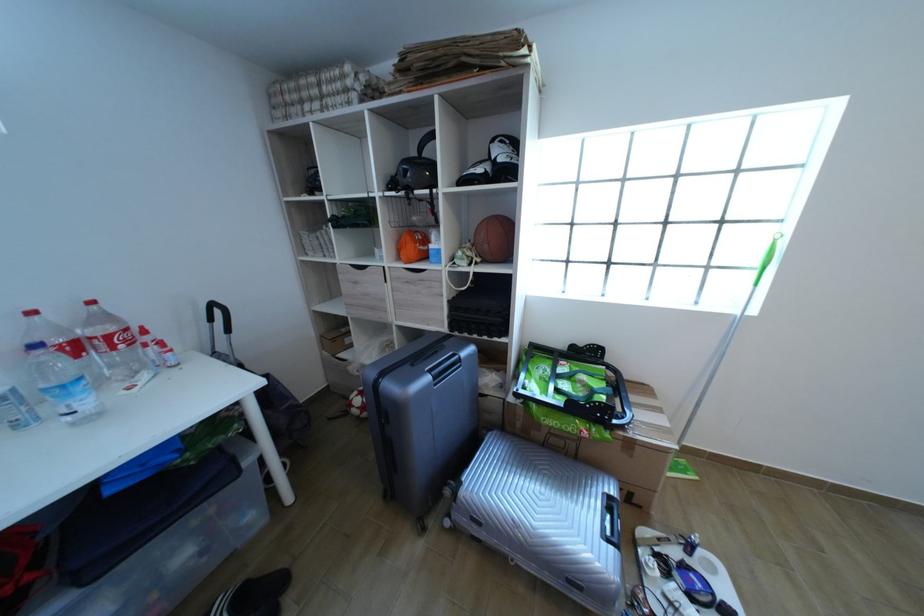
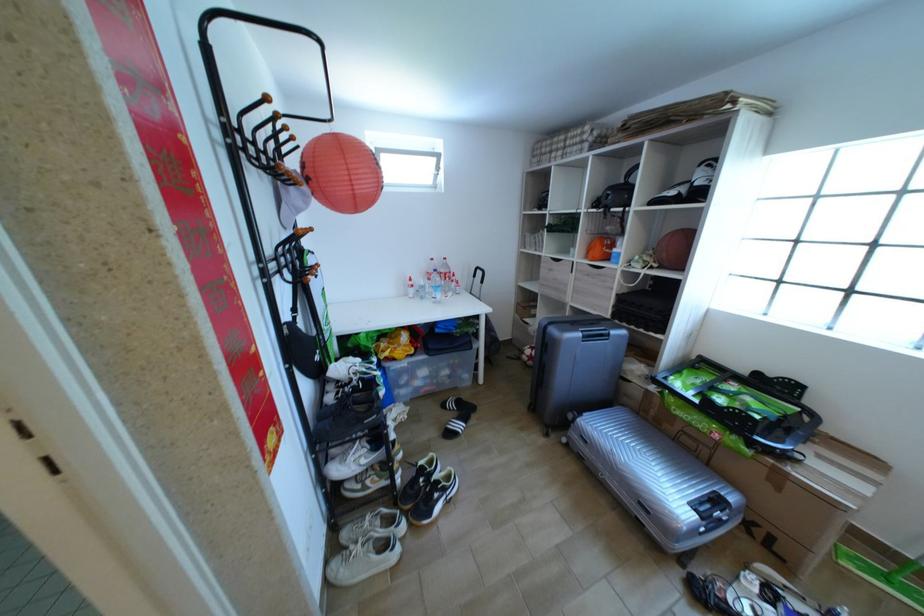
Question: The first image is from the beginning of the video and the second image is from the end. How did the camera likely rotate when shooting the video?

Choices:
 (A) Left
 (B) Right
 (C) Up
 (D) Down

Answer: (A)